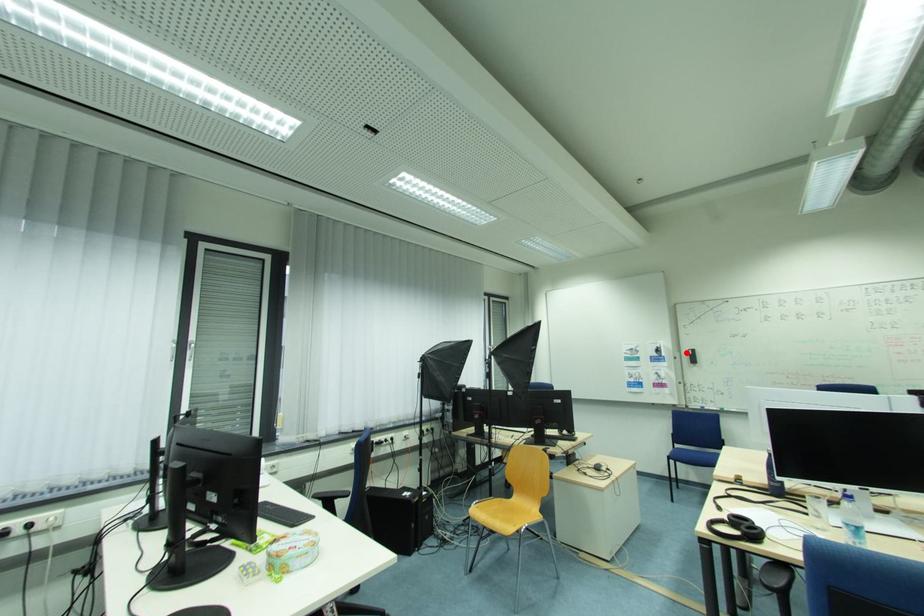
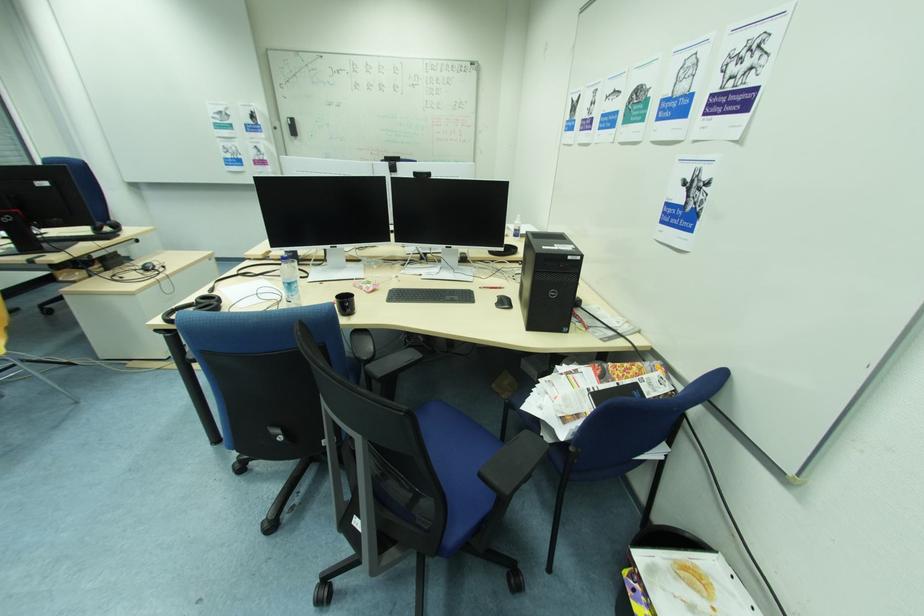
The point at the highlighted location is marked in the first image. Where is the corresponding point in the second image?

(286, 122)